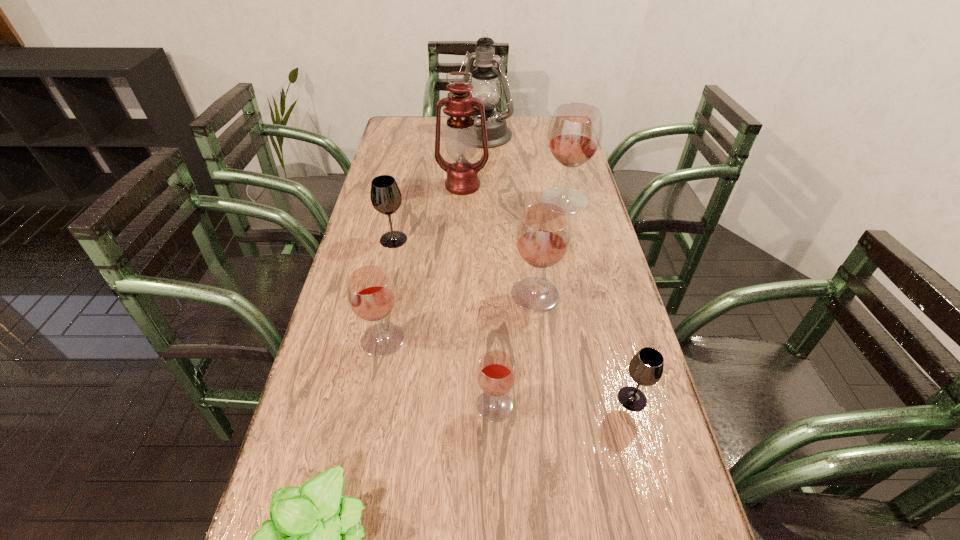
Find the location of a particular element. vacant space situated 0.210m on the back of the smaller gray wineglass is located at coordinates (610, 313).

Where is `free space located 0.180m on the left of the fourth wineglass from right to left`? The image size is (960, 540). free space located 0.180m on the left of the fourth wineglass from right to left is located at coordinates (392, 406).

This screenshot has height=540, width=960. Identify the location of object that is positioned at the far edge. (486, 87).

Where is `vacant space at the left edge`? Image resolution: width=960 pixels, height=540 pixels. vacant space at the left edge is located at coordinates (405, 227).

This screenshot has height=540, width=960. In the image, there is a desktop. Identify the location of vacant space at the right edge. (596, 238).

Where is `vacant region at the far left corner of the desktop`? This screenshot has width=960, height=540. vacant region at the far left corner of the desktop is located at coordinates (397, 136).

Identify the location of blank area at the far right corner. (540, 137).

This screenshot has height=540, width=960. Identify the location of blank region between the farther gray wineglass and the farther oil lamp. (439, 188).

Find the location of a particular element. free space between the farther gray wineglass and the third wineglass from left to right is located at coordinates (444, 322).

The image size is (960, 540). In order to click on free space that is in between the farther oil lamp and the left gray wineglass in this screenshot , I will do `click(439, 188)`.